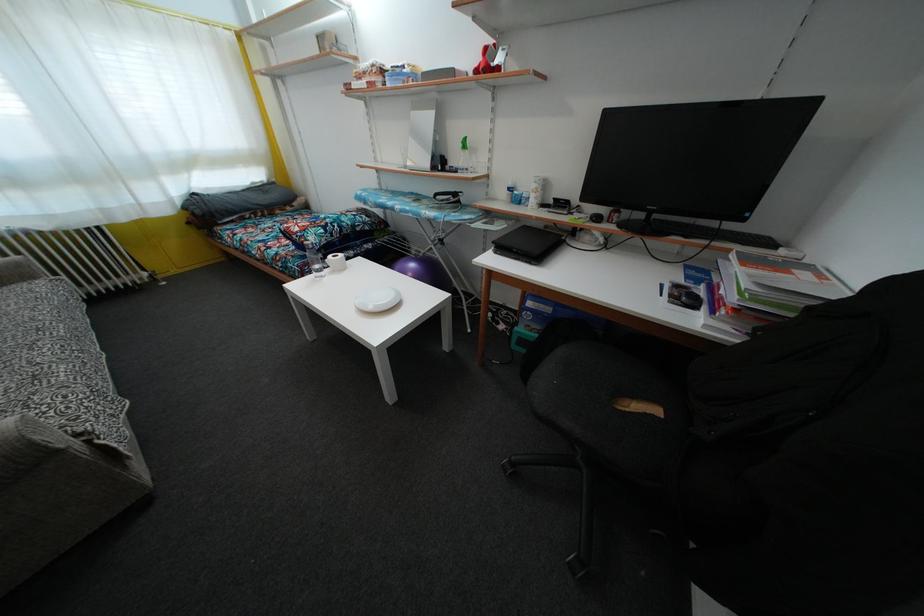
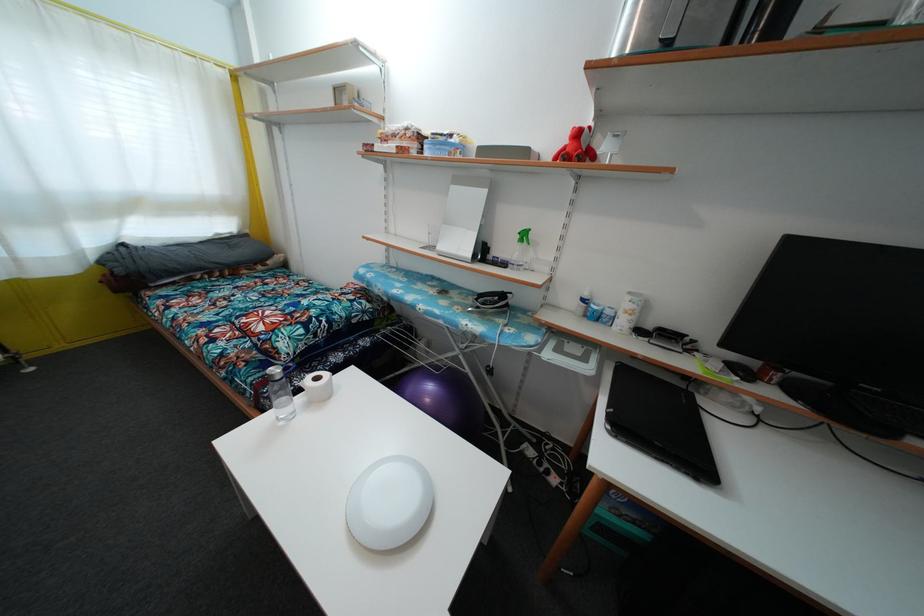
Question: Based on the continuous images, in which direction is the camera rotating? Reply with the corresponding letter.

Choices:
 (A) Left
 (B) Right
 (C) Up
 (D) Down

Answer: (C)